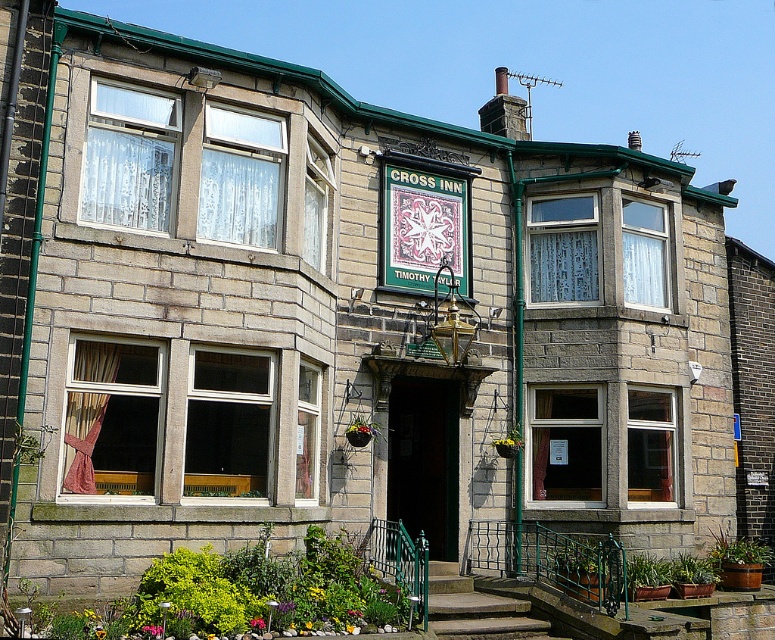
Question: Which object is farther from the camera taking this photo?

Choices:
 (A) green fabric sign at center
 (B) concrete steps at center

Answer: (A)

Question: Considering the relative positions of green fabric sign at center and concrete steps at center in the image provided, where is green fabric sign at center located with respect to concrete steps at center?

Choices:
 (A) right
 (B) left

Answer: (B)

Question: Is green fabric sign at center to the right of concrete steps at center from the viewer's perspective?

Choices:
 (A) yes
 (B) no

Answer: (B)

Question: Which object is farther from the camera taking this photo?

Choices:
 (A) concrete steps at center
 (B) green fabric sign at center

Answer: (B)

Question: Where is green fabric sign at center located in relation to concrete steps at center in the image?

Choices:
 (A) left
 (B) right

Answer: (A)